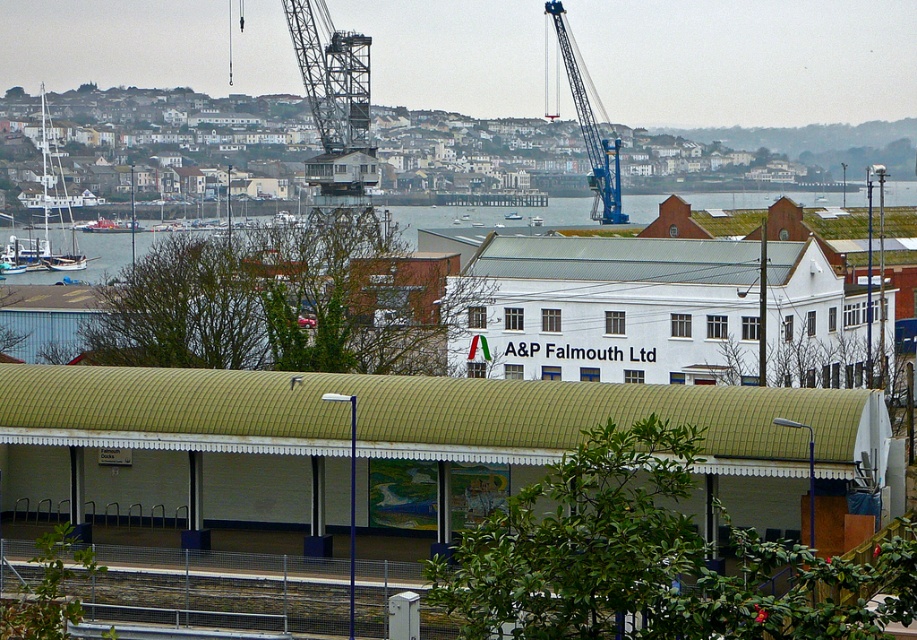
Between blue metallic crane at upper center and white wooden boat at center, which one has more height?

blue metallic crane at upper center is taller.

Does point (564, 51) come in front of point (515, 212)?

Yes, point (564, 51) is in front of point (515, 212).

I want to click on blue metallic crane at upper center, so click(x=590, y=125).

Based on the photo, can you confirm if greenish-blue water at center is positioned above white wooden boat at center?

Incorrect, greenish-blue water at center is not positioned above white wooden boat at center.

Who is taller, greenish-blue water at center or white wooden boat at center?

greenish-blue water at center

Who is more forward, (774, 195) or (515, 218)?

Point (515, 218) is more forward.

Locate an element on the screen. greenish-blue water at center is located at coordinates (485, 216).

Who is more forward, (482, 227) or (612, 198)?

Point (612, 198) is in front.

Is point (116, 237) positioned after point (558, 36)?

Yes, point (116, 237) is farther from viewer.

What do you see at coordinates (485, 216) in the screenshot?
I see `greenish-blue water at center` at bounding box center [485, 216].

At what (x,y) coordinates should I click in order to perform the action: click on greenish-blue water at center. Please return your answer as a coordinate pair (x, y). Looking at the image, I should click on (485, 216).